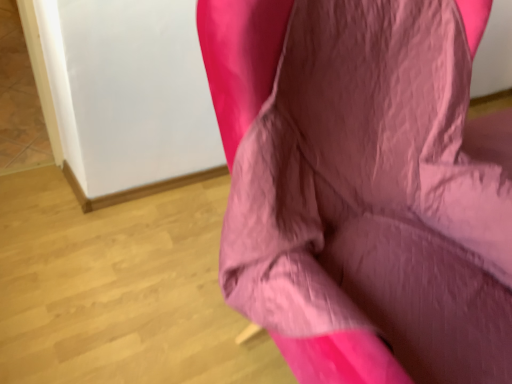
Measure the distance between pink fabric chair at upper right and camera.

They are 59.03 centimeters apart.

Image resolution: width=512 pixels, height=384 pixels. What are the coordinates of `pink fabric chair at upper right` in the screenshot? It's located at (361, 188).

Describe the element at coordinates (361, 188) in the screenshot. I see `pink fabric chair at upper right` at that location.

Locate an element on the screen. This screenshot has width=512, height=384. pink fabric chair at upper right is located at coordinates (361, 188).